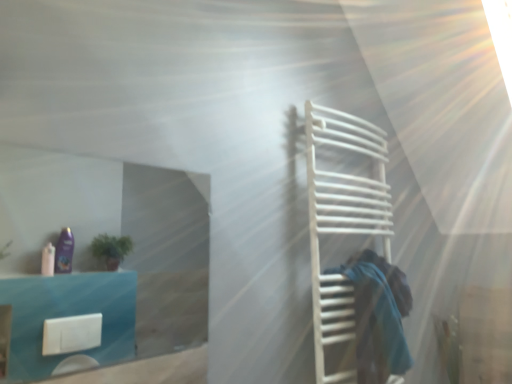
Question: Is white matte towel rack at right spatially inside transparent glass door at upper left, or outside of it?

Choices:
 (A) inside
 (B) outside

Answer: (B)

Question: In terms of width, does white matte towel rack at right look wider or thinner when compared to transparent glass door at upper left?

Choices:
 (A) wide
 (B) thin

Answer: (A)

Question: Estimate the real-world distances between objects in this image. Which object is farther from the white matte towel rack at right?

Choices:
 (A) transparent glass door at upper left
 (B) blue fabric at right

Answer: (A)

Question: Estimate the real-world distances between objects in this image. Which object is farther from the white matte towel rack at right?

Choices:
 (A) transparent glass door at upper left
 (B) blue fabric at right

Answer: (A)